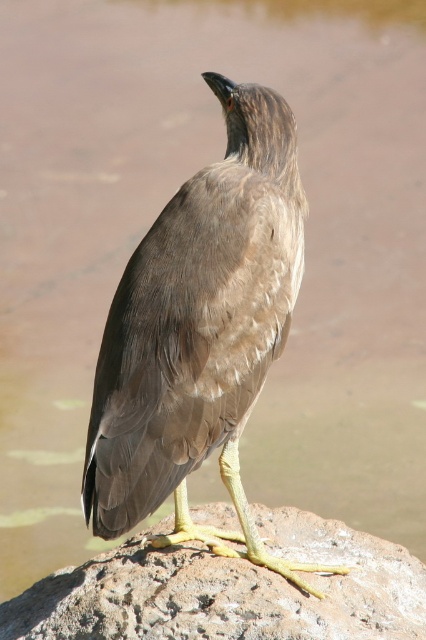
You are a wildlife photographer aiming to capture a closeup of the brown feathered bird at center. Your camera can focus on subjects within 5 feet. Based on the scene, can you get a clear closeup shot of the bird?

The brown feathered bird at center is 8.78 feet from the camera, which is beyond the 5 feet focusing range. Therefore, you cannot get a clear closeup shot with your current camera settings.

You are a nature photographer aiming to capture the brown feathered bird at center and the rocky surface at center in a single frame. Based on their positions, which object should you adjust your camera focus to first to ensure both are in the frame?

The brown feathered bird at center is to the right of rocky surface at center, so you should adjust your camera focus to the rocky surface at center first to ensure both are in the frame.

You are observing a bird and a rocky surface in the image. Based on their positions, can you tell if the brown feathered bird at center is resting on the rocky surface at center?

Yes, the brown feathered bird at center is resting on the rocky surface at center because it is positioned above the rocky surface at center.